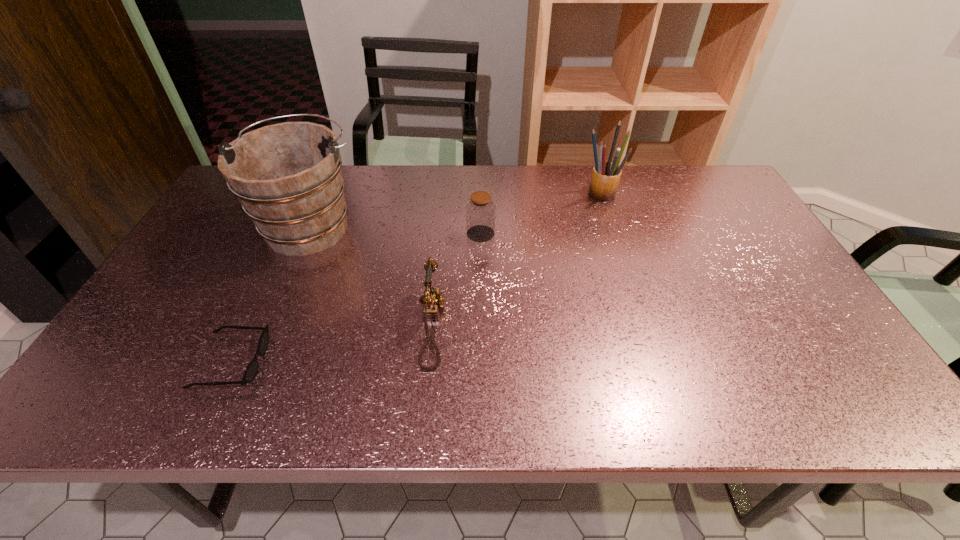
Locate an element on the screen. The height and width of the screenshot is (540, 960). vacant space located 0.190m on the back of the jar is located at coordinates (481, 189).

Identify the location of vacant region located 0.200m on the front-facing side of the third object from right to left. This screenshot has width=960, height=540. [x=530, y=326].

What are the coordinates of `vacant area situated 0.400m on the front-facing side of the shortest object` in the screenshot? It's located at (444, 362).

In order to click on bucket situated at the far edge in this screenshot , I will do `click(287, 176)`.

At what (x,y) coordinates should I click in order to perform the action: click on pencil box located at the far edge. Please return your answer as a coordinate pair (x, y). Looking at the image, I should click on (605, 178).

Where is `object located at the near edge`? The width and height of the screenshot is (960, 540). object located at the near edge is located at coordinates (252, 368).

Find the location of a particular element. The height and width of the screenshot is (540, 960). object positioned at the left edge is located at coordinates (287, 176).

Locate an element on the screen. object at the far left corner is located at coordinates (287, 176).

Where is `vacant point at the far edge`? vacant point at the far edge is located at coordinates (442, 185).

This screenshot has width=960, height=540. I want to click on vacant point at the near edge, so click(562, 389).